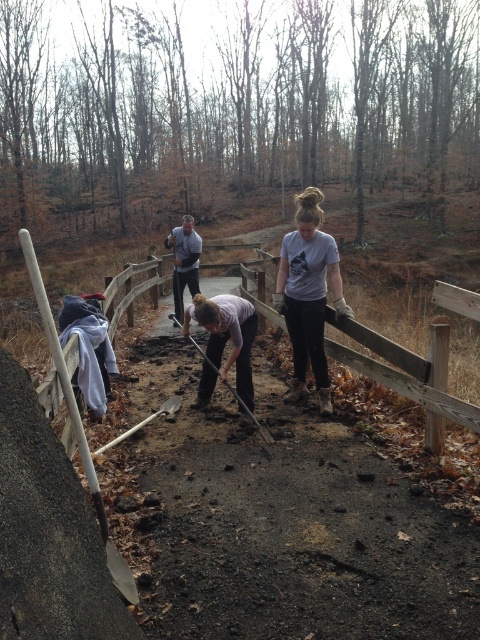
You are standing at the point with coordinates point [309,294] in the image. What object are you currently standing on?

You are standing on the light gray t shirt at center.